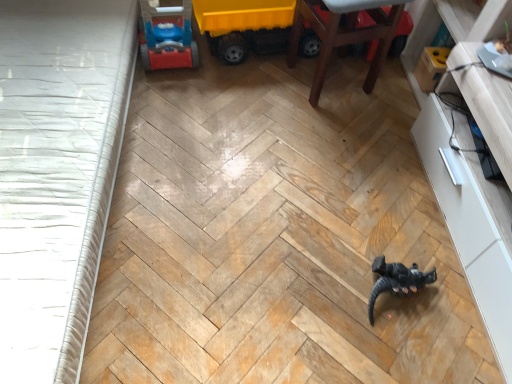
This screenshot has height=384, width=512. Find the location of `free space on the front side of wooden chair at upper right`. free space on the front side of wooden chair at upper right is located at coordinates (327, 130).